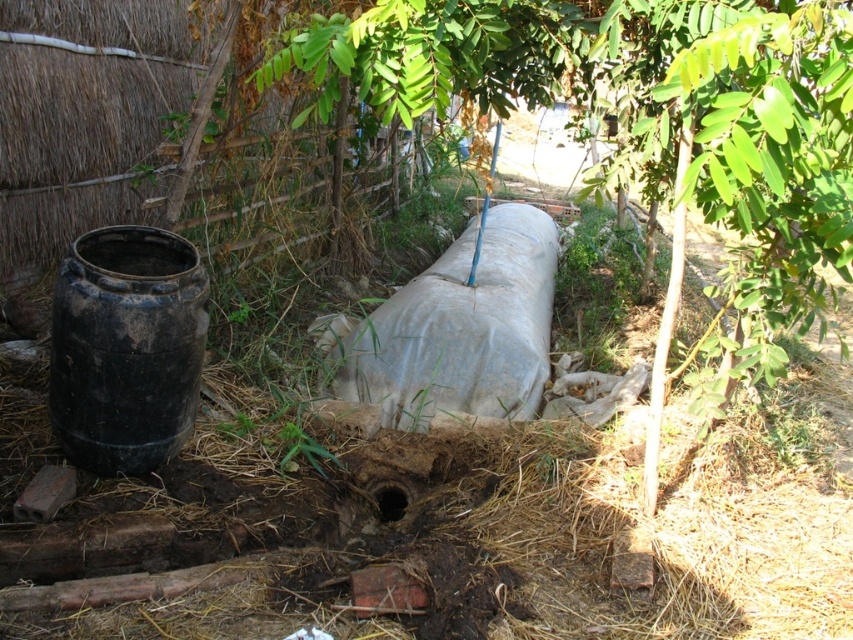
Between green leafy tree at center and gray matte tank at center, which one appears on the left side from the viewer's perspective?

gray matte tank at center is more to the left.

Between green leafy tree at center and gray matte tank at center, which one has more height?

With more height is green leafy tree at center.

Measure the distance between green leafy tree at center and camera.

green leafy tree at center and camera are 6.79 feet apart from each other.

Image resolution: width=853 pixels, height=640 pixels. Identify the location of green leafy tree at center. (653, 122).